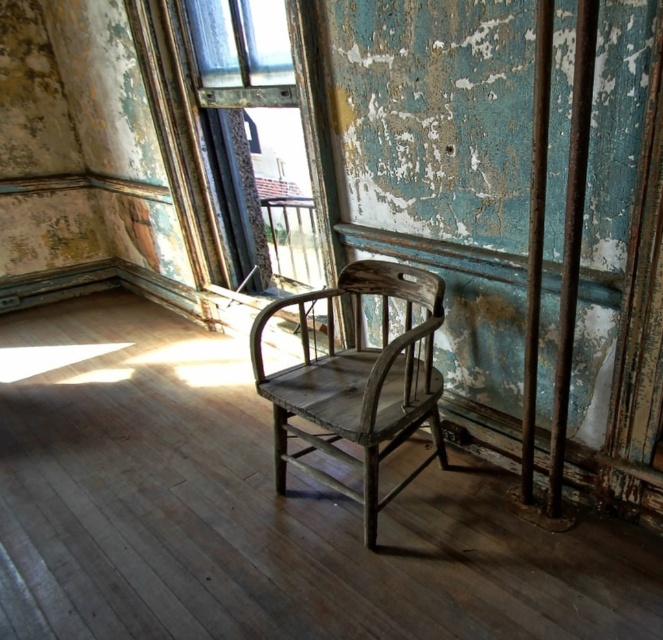
Can you confirm if wooden frame at center is positioned to the right of weathered wood chair at center?

No, wooden frame at center is not to the right of weathered wood chair at center.

Is wooden frame at center above weathered wood chair at center?

Yes, wooden frame at center is above weathered wood chair at center.

Is point (267, 81) farther from viewer compared to point (420, 420)?

Yes, it is behind point (420, 420).

Find the location of a particular element. wooden frame at center is located at coordinates (233, 120).